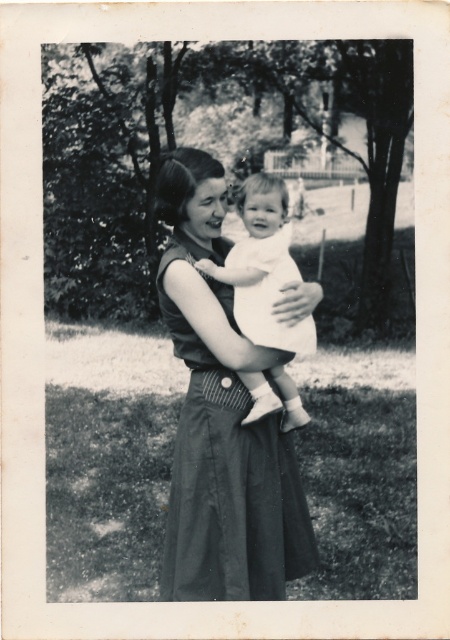
Question: Is matte black dress at center to the left of white clothed baby at center from the viewer's perspective?

Choices:
 (A) yes
 (B) no

Answer: (A)

Question: Which of the following is the farthest from the observer?

Choices:
 (A) (243, 369)
 (B) (270, 221)
 (C) (279, 284)
 (D) (64, 136)

Answer: (D)

Question: Estimate the real-world distances between objects in this image. Which object is farther from the grassy lawn at center?

Choices:
 (A) matte black dress at center
 (B) white cotton dress at center

Answer: (B)

Question: Does grassy lawn at center have a smaller size compared to white clothed baby at center?

Choices:
 (A) yes
 (B) no

Answer: (B)

Question: Which object appears closest to the camera in this image?

Choices:
 (A) white cotton dress at center
 (B) matte black dress at center
 (C) white clothed baby at center

Answer: (B)

Question: Where is grassy lawn at center located in relation to matte black dress at center in the image?

Choices:
 (A) right
 (B) left

Answer: (B)